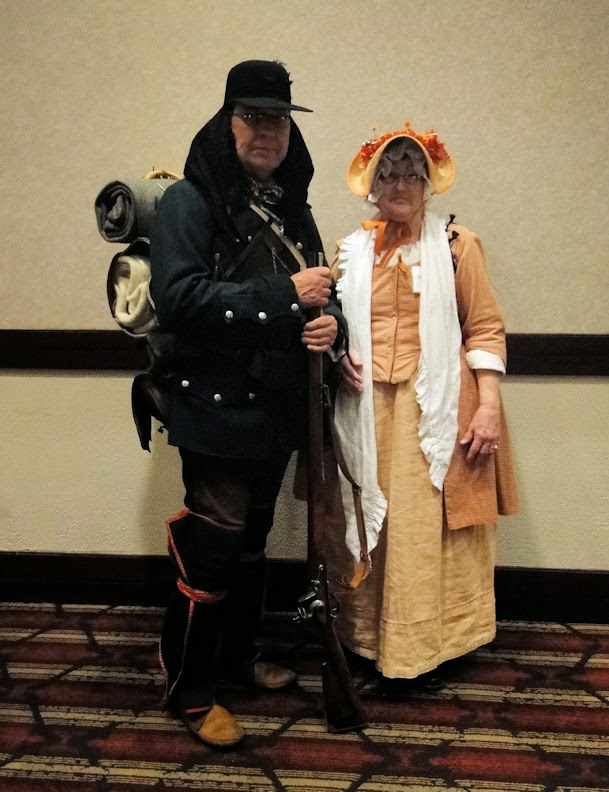
Where is `dizzying carpet`? dizzying carpet is located at coordinates (35, 648), (127, 642), (64, 754), (324, 771), (318, 726), (499, 760), (567, 644), (589, 745).